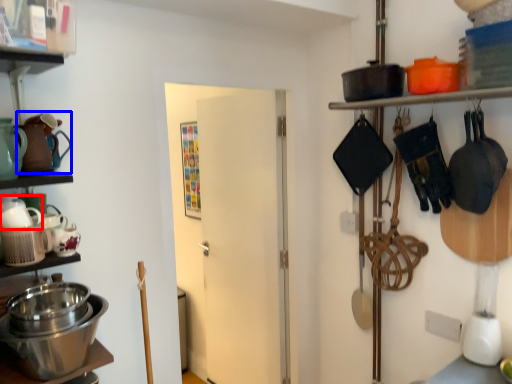
Question: Which object appears farthest to the camera in this image, tea pot (highlighted by a red box) or tea pot (highlighted by a blue box)?

Choices:
 (A) tea pot
 (B) tea pot

Answer: (B)